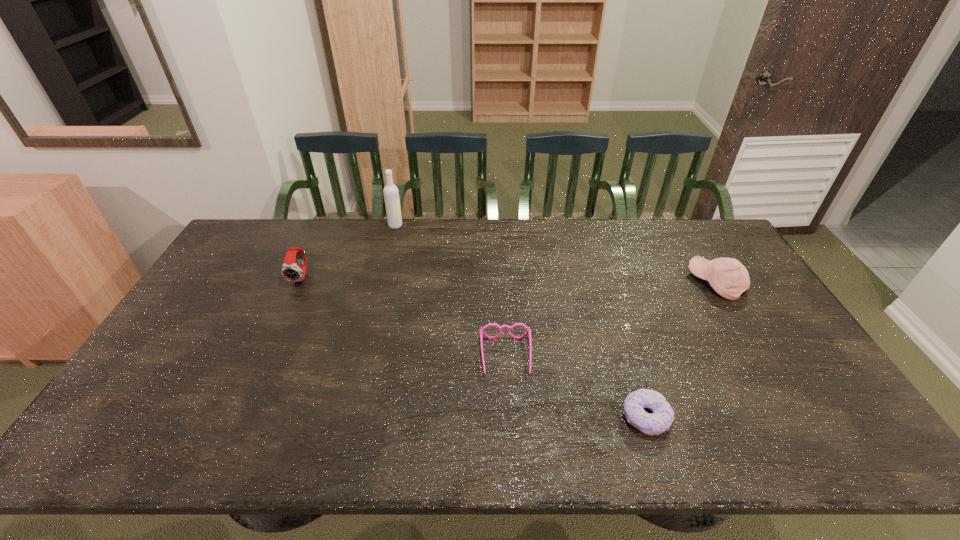
Identify the location of free space located on the front-facing side of the baseball cap. [x=660, y=282].

The image size is (960, 540). Find the location of `free region located on the front-facing side of the baseball cap`. free region located on the front-facing side of the baseball cap is located at coordinates pos(676,282).

Identify the location of free space located 0.190m on the front-facing side of the baseball cap. This screenshot has width=960, height=540. (633, 282).

The width and height of the screenshot is (960, 540). Identify the location of free space located 0.200m on the arms of the third object from left to right. (512, 451).

At what (x,y) coordinates should I click in order to perform the action: click on free space located 0.250m on the back of the nearest object. Please return your answer as a coordinate pair (x, y). Looking at the image, I should click on (616, 324).

Find the location of `object that is at the far edge`. object that is at the far edge is located at coordinates (391, 194).

Identify the location of object that is at the near edge. (663, 415).

Find the location of a particular element. The height and width of the screenshot is (540, 960). object that is at the right edge is located at coordinates (728, 277).

This screenshot has height=540, width=960. I want to click on vacant space at the far edge, so click(x=567, y=259).

You are a GUI agent. You are given a task and a screenshot of the screen. Output one action in this format:
    pyautogui.click(x=<x>, y=<y>)
    Task: Click on the free location at the near edge of the desktop
    The height and width of the screenshot is (540, 960).
    Given the screenshot: What is the action you would take?
    pyautogui.click(x=716, y=442)